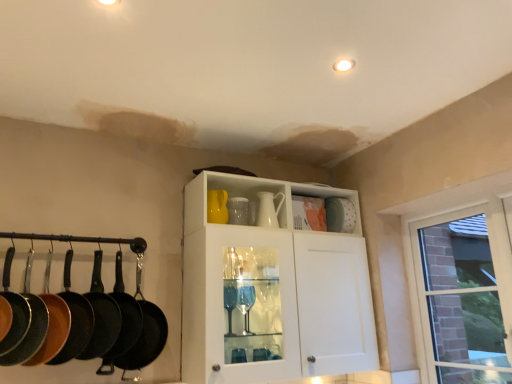
Question: Is white glossy tea pot at center, positioned as the first tea pot in right-to-left order, closer to the viewer compared to black cast iron frying pan at left, the 4th frying pan viewed from the right?

Choices:
 (A) yes
 (B) no

Answer: (B)

Question: Is white glossy tea pot at center, which is counted as the 2th tea pot, starting from the left, at the right side of black cast iron frying pan at left, the 4th frying pan viewed from the right?

Choices:
 (A) no
 (B) yes

Answer: (B)

Question: From the image's perspective, is white glossy tea pot at center, positioned as the first tea pot in right-to-left order, under black cast iron frying pan at left, the 4th frying pan viewed from the right?

Choices:
 (A) no
 (B) yes

Answer: (A)

Question: From a real-world perspective, is white glossy tea pot at center, which is counted as the 2th tea pot, starting from the left, located higher than black cast iron frying pan at left, which is the 3th frying pan in left-to-right order?

Choices:
 (A) yes
 (B) no

Answer: (A)

Question: Does white glossy tea pot at center, which is counted as the 2th tea pot, starting from the left, appear on the left side of black cast iron frying pan at left, the 4th frying pan viewed from the right?

Choices:
 (A) yes
 (B) no

Answer: (B)

Question: Can you confirm if white glossy tea pot at center, positioned as the first tea pot in right-to-left order, is thinner than black cast iron frying pan at left, which is the 3th frying pan in left-to-right order?

Choices:
 (A) yes
 (B) no

Answer: (B)

Question: Is white matte platter at upper right at the left side of matte black frying pan at left, the first frying pan viewed from the left?

Choices:
 (A) no
 (B) yes

Answer: (A)

Question: Is white matte platter at upper right turned away from matte black frying pan at left, which is the 6th frying pan from right to left?

Choices:
 (A) no
 (B) yes

Answer: (A)

Question: Is white matte platter at upper right aimed at matte black frying pan at left, which is the 6th frying pan from right to left?

Choices:
 (A) yes
 (B) no

Answer: (B)

Question: Does white matte platter at upper right appear on the right side of matte black frying pan at left, the first frying pan viewed from the left?

Choices:
 (A) yes
 (B) no

Answer: (A)

Question: Does white matte platter at upper right have a larger size compared to matte black frying pan at left, the first frying pan viewed from the left?

Choices:
 (A) yes
 (B) no

Answer: (B)

Question: Is white matte platter at upper right further to the viewer compared to matte black frying pan at left, the first frying pan viewed from the left?

Choices:
 (A) yes
 (B) no

Answer: (A)

Question: Can you confirm if white matte platter at upper right is positioned to the right of matte yellow tea pot at upper center, the 1th tea pot viewed from the left?

Choices:
 (A) no
 (B) yes

Answer: (B)